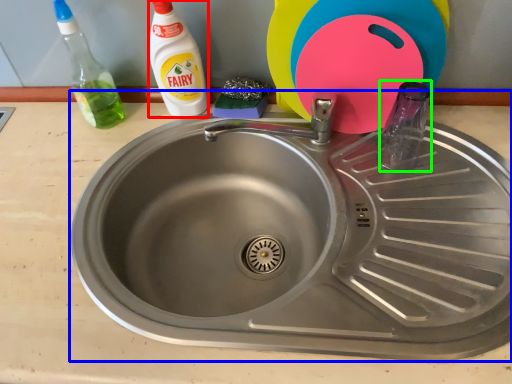
Question: Estimate the real-world distances between objects in this image. Which object is farther from cleaning product (highlighted by a red box), sink (highlighted by a blue box) or bottle (highlighted by a green box)?

Choices:
 (A) sink
 (B) bottle

Answer: (B)